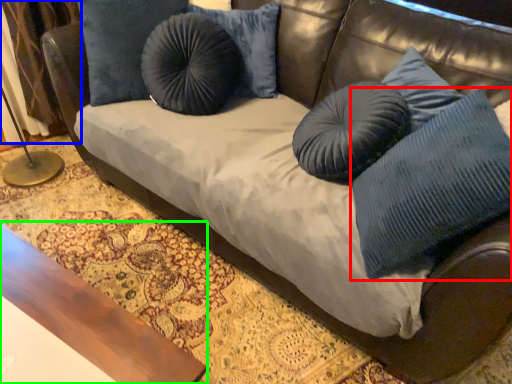
Question: Which object is positioned closest to pillow (highlighted by a red box)? Select from curtain (highlighted by a blue box) and table (highlighted by a green box).

Choices:
 (A) curtain
 (B) table

Answer: (B)